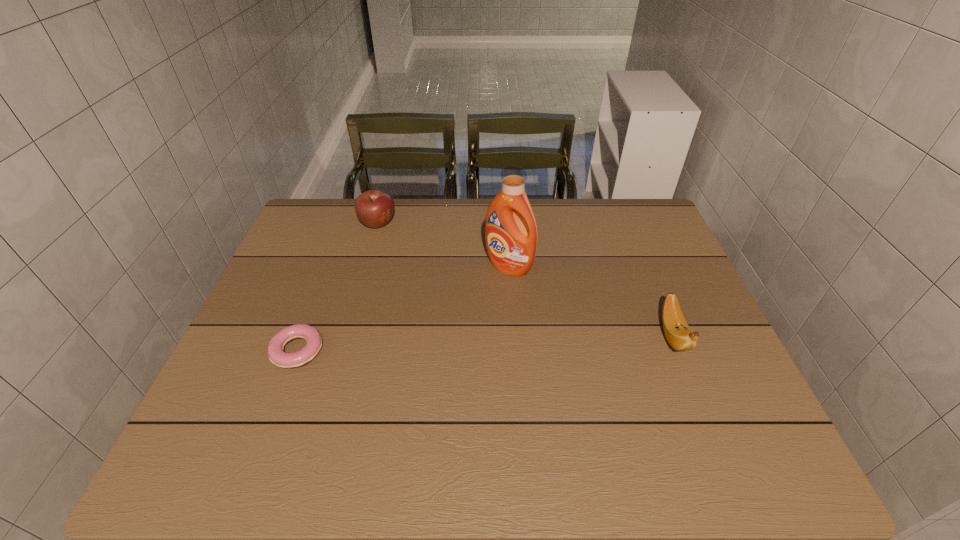
Locate an element on the screen. This screenshot has height=540, width=960. vacant region located 0.220m on the front-facing side of the second object from right to left is located at coordinates (447, 326).

Locate an element on the screen. The height and width of the screenshot is (540, 960). vacant space situated on the front-facing side of the second object from right to left is located at coordinates (443, 330).

At what (x,y) coordinates should I click in order to perform the action: click on vacant space located on the front-facing side of the second object from right to left. Please return your answer as a coordinate pair (x, y). The width and height of the screenshot is (960, 540). Looking at the image, I should click on (402, 372).

At what (x,y) coordinates should I click in order to perform the action: click on object positioned at the far edge. Please return your answer as a coordinate pair (x, y). Looking at the image, I should click on (374, 208).

At what (x,y) coordinates should I click in order to perform the action: click on object located at the left edge. Please return your answer as a coordinate pair (x, y). Looking at the image, I should click on pyautogui.click(x=277, y=356).

You are a GUI agent. You are given a task and a screenshot of the screen. Output one action in this format:
    pyautogui.click(x=<x>, y=<y>)
    Task: Click on the object situated at the right edge
    
    Given the screenshot: What is the action you would take?
    pyautogui.click(x=679, y=335)

The height and width of the screenshot is (540, 960). Identify the location of free space at the far edge. (433, 206).

In the image, there is a desktop. Identify the location of free space at the left edge. (288, 291).

Where is `vacant space at the right edge of the desktop`? The width and height of the screenshot is (960, 540). vacant space at the right edge of the desktop is located at coordinates (652, 301).

Where is `vacant space at the far left corner of the desktop`? The height and width of the screenshot is (540, 960). vacant space at the far left corner of the desktop is located at coordinates (336, 219).